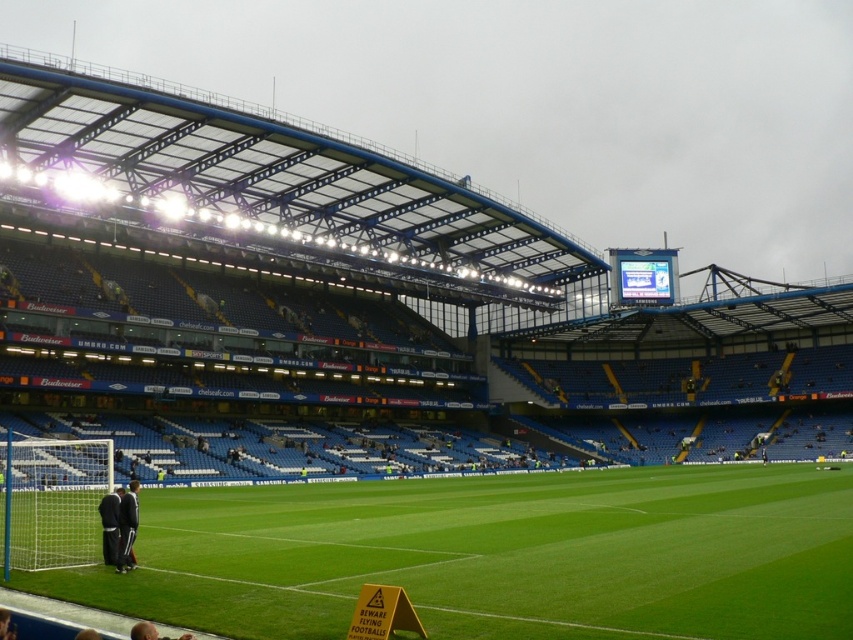
Question: Where is white mesh net at lower left located in relation to dark gray tracksuit at lower left in the image?

Choices:
 (A) below
 (B) above

Answer: (A)

Question: Can you confirm if green grass football field at lower left is positioned to the right of white mesh net at lower left?

Choices:
 (A) no
 (B) yes

Answer: (B)

Question: Which of the following is the closest to the observer?

Choices:
 (A) dark gray tracksuit at lower left
 (B) white mesh net at lower left

Answer: (B)

Question: Which point appears closest to the camera in this image?

Choices:
 (A) 62,460
 (B) 115,560
 (C) 109,500
 (D) 727,504

Answer: (B)

Question: From the image, what is the correct spatial relationship of white mesh net at lower left in relation to dark blue jersey at lower left?

Choices:
 (A) right
 (B) left

Answer: (B)

Question: Which object is closer to the camera taking this photo?

Choices:
 (A) dark gray tracksuit at lower left
 (B) white mesh net at lower left
 (C) green grass football field at lower left
 (D) dark blue jersey at lower left

Answer: (C)